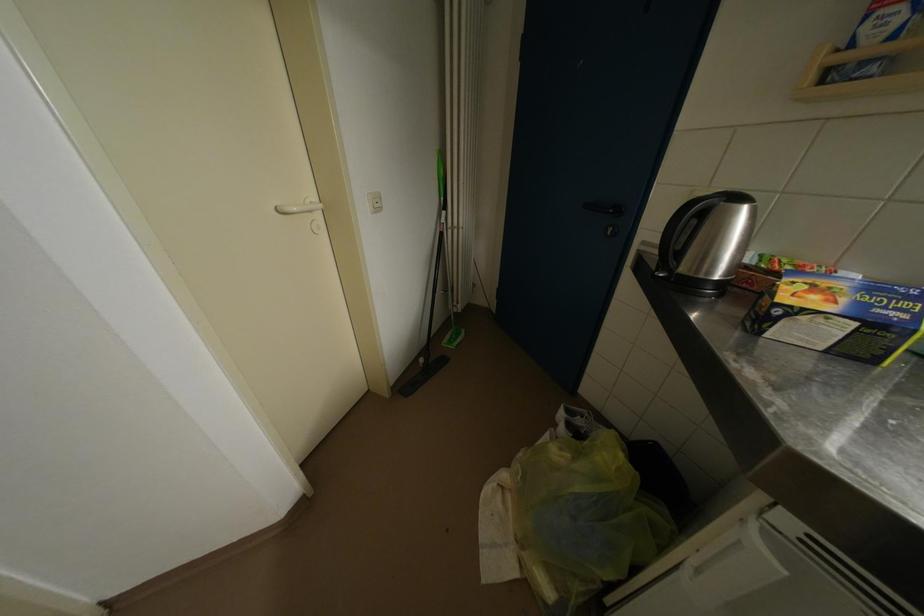
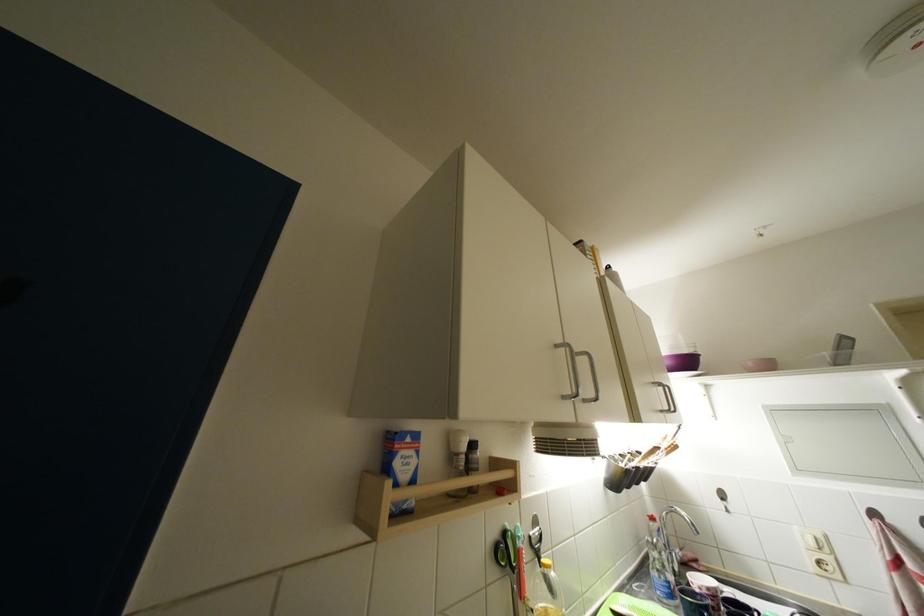
Question: Based on the continuous images, in which direction is the camera rotating? Reply with the corresponding letter.

Choices:
 (A) Left
 (B) Right
 (C) Up
 (D) Down

Answer: (B)